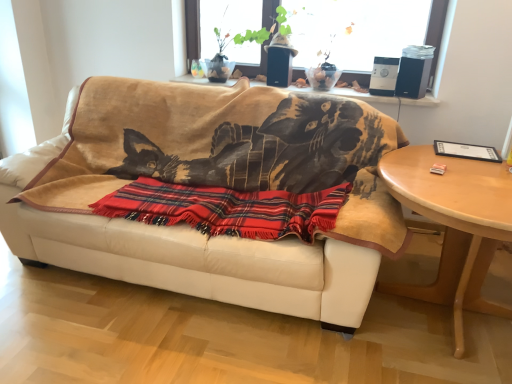
Question: Does white leather couch at center turn towards plaid fabric blanket at center?

Choices:
 (A) yes
 (B) no

Answer: (A)

Question: From a real-world perspective, is white leather couch at center located beneath plaid fabric blanket at center?

Choices:
 (A) yes
 (B) no

Answer: (A)

Question: Is white leather couch at center not near plaid fabric blanket at center?

Choices:
 (A) no
 (B) yes

Answer: (A)

Question: Does white leather couch at center have a larger size compared to plaid fabric blanket at center?

Choices:
 (A) yes
 (B) no

Answer: (A)

Question: Can you confirm if white leather couch at center is wider than plaid fabric blanket at center?

Choices:
 (A) yes
 (B) no

Answer: (A)

Question: Is white leather couch at center smaller than plaid fabric blanket at center?

Choices:
 (A) yes
 (B) no

Answer: (B)

Question: Is light wood/finished table at right not near plaid fabric blanket at center?

Choices:
 (A) yes
 (B) no

Answer: (B)

Question: From a real-world perspective, does light wood/finished table at right sit lower than plaid fabric blanket at center?

Choices:
 (A) no
 (B) yes

Answer: (B)

Question: From the image's perspective, is light wood/finished table at right below plaid fabric blanket at center?

Choices:
 (A) no
 (B) yes

Answer: (B)

Question: Considering the relative sizes of light wood/finished table at right and plaid fabric blanket at center in the image provided, is light wood/finished table at right thinner than plaid fabric blanket at center?

Choices:
 (A) no
 (B) yes

Answer: (A)

Question: Is light wood/finished table at right positioned with its back to plaid fabric blanket at center?

Choices:
 (A) yes
 (B) no

Answer: (B)

Question: Can you confirm if light wood/finished table at right is smaller than plaid fabric blanket at center?

Choices:
 (A) no
 (B) yes

Answer: (A)

Question: Considering the relative positions of light wood/finished table at right and white leather couch at center in the image provided, is light wood/finished table at right in front of white leather couch at center?

Choices:
 (A) yes
 (B) no

Answer: (A)